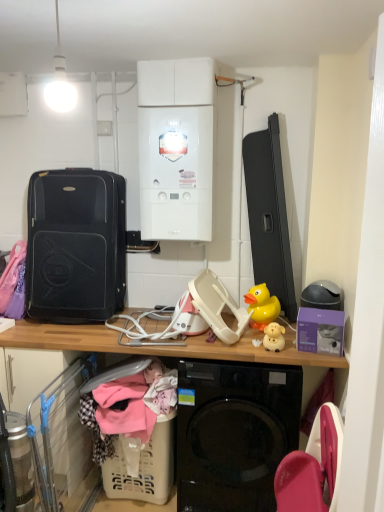
Describe the element at coordinates (160, 345) in the screenshot. I see `wooden desk at center` at that location.

Find the location of a particular element. This screenshot has width=384, height=512. matte yellow plastic toy at center, which is counted as the 1th toy, starting from the front is located at coordinates (274, 337).

In order to click on black hardshell suitcase at left in this screenshot , I will do `click(75, 245)`.

Locate an element on the screen. wooden desk at center is located at coordinates point(160,345).

How many degrees apart are the facing directions of yellow rubber duck at upper right, positioned as the 1th toy in back-to-front order, and beige plastic laundry basket at lower left?

The facing directions of yellow rubber duck at upper right, positioned as the 1th toy in back-to-front order, and beige plastic laundry basket at lower left are 43.2 degrees apart.

Is yellow rubber duck at upper right, which appears as the 2th toy when viewed from the front, aimed at beige plastic laundry basket at lower left?

No, yellow rubber duck at upper right, which appears as the 2th toy when viewed from the front, is not oriented towards beige plastic laundry basket at lower left.

Are yellow rubber duck at upper right, positioned as the 1th toy in back-to-front order, and beige plastic laundry basket at lower left far apart?

Actually, yellow rubber duck at upper right, positioned as the 1th toy in back-to-front order, and beige plastic laundry basket at lower left are a little close together.

Which is less distant, (115,406) or (32,308)?

The point (115,406) is closer to the camera.

Would you consider soft cotton clothes at lower center to be distant from black hardshell suitcase at left?

No.

The height and width of the screenshot is (512, 384). I want to click on clothing in front of the black hardshell suitcase at left, so click(128, 408).

Is beige plastic laundry basket at lower left next to black hardshell suitcase at left?

No, beige plastic laundry basket at lower left is not touching black hardshell suitcase at left.

Looking at this image, could black hardshell suitcase at left be considered to be inside beige plastic laundry basket at lower left?

No, black hardshell suitcase at left is not a part of beige plastic laundry basket at lower left.

The width and height of the screenshot is (384, 512). Find the location of `basket that appears below the black hardshell suitcase at left (from the image's perspective)`. basket that appears below the black hardshell suitcase at left (from the image's perspective) is located at coordinates pyautogui.click(x=144, y=466).

Which of these two, beige plastic laundry basket at lower left or black hardshell suitcase at left, is thinner?

With smaller width is beige plastic laundry basket at lower left.

From a real-world perspective, is yellow rubber duck at upper right, positioned as the 1th toy in back-to-front order, located higher than white glossy boiler at upper center?

Incorrect, from a real-world perspective, yellow rubber duck at upper right, positioned as the 1th toy in back-to-front order, is lower than white glossy boiler at upper center.

Considering the relative sizes of yellow rubber duck at upper right, positioned as the 1th toy in back-to-front order, and white glossy boiler at upper center in the image provided, is yellow rubber duck at upper right, positioned as the 1th toy in back-to-front order, taller than white glossy boiler at upper center?

In fact, yellow rubber duck at upper right, positioned as the 1th toy in back-to-front order, may be shorter than white glossy boiler at upper center.

Considering the sizes of yellow rubber duck at upper right, which appears as the 2th toy when viewed from the front, and white glossy boiler at upper center in the image, is yellow rubber duck at upper right, which appears as the 2th toy when viewed from the front, bigger or smaller than white glossy boiler at upper center?

yellow rubber duck at upper right, which appears as the 2th toy when viewed from the front, is smaller than white glossy boiler at upper center.

Between yellow rubber duck at upper right, which appears as the 2th toy when viewed from the front, and white glossy boiler at upper center, which one has smaller width?

yellow rubber duck at upper right, which appears as the 2th toy when viewed from the front.

Is wooden desk at center inside the boundaries of matte yellow plastic toy at center, the second toy positioned from the back, or outside?

wooden desk at center is located beyond the bounds of matte yellow plastic toy at center, the second toy positioned from the back.

Is wooden desk at center bigger than matte yellow plastic toy at center, which is counted as the 1th toy, starting from the front?

Yes, wooden desk at center is bigger than matte yellow plastic toy at center, which is counted as the 1th toy, starting from the front.

From the image's perspective, is wooden desk at center below matte yellow plastic toy at center, the second toy positioned from the back?

Yes, from the image's perspective, wooden desk at center is beneath matte yellow plastic toy at center, the second toy positioned from the back.

Is wooden desk at center not close to white glossy boiler at upper center?

They are positioned close to each other.

From the image's perspective, which one is positioned higher, wooden desk at center or white glossy boiler at upper center?

white glossy boiler at upper center is shown above in the image.

Is wooden desk at center taller or shorter than white glossy boiler at upper center?

Considering their sizes, wooden desk at center has less height than white glossy boiler at upper center.

Is wooden desk at center outside of white glossy boiler at upper center?

Yes.

Which is more to the right, soft cotton clothes at lower center or wooden desk at center?

wooden desk at center is more to the right.

Where is `desk in front of the soft cotton clothes at lower center`? desk in front of the soft cotton clothes at lower center is located at coordinates (160, 345).

Is soft cotton clothes at lower center oriented towards wooden desk at center?

Yes.

Considering the relative sizes of soft cotton clothes at lower center and wooden desk at center in the image provided, is soft cotton clothes at lower center taller than wooden desk at center?

No, soft cotton clothes at lower center is not taller than wooden desk at center.

Locate an element on the screen. Image resolution: width=384 pixels, height=512 pixels. the 2nd toy above the beige plastic laundry basket at lower left (from a real-world perspective) is located at coordinates (262, 306).

Find the location of a particular element. This screenshot has height=512, width=384. clothing on the right of black hardshell suitcase at left is located at coordinates (128, 408).

Estimate the real-world distances between objects in this image. Which object is further from soft cotton clothes at lower center, beige plastic laundry basket at lower left or wooden desk at center?

wooden desk at center is positioned further to the anchor soft cotton clothes at lower center.

From the image, which object appears to be farther from wooden desk at center, beige plastic laundry basket at lower left or black hardshell suitcase at left?

beige plastic laundry basket at lower left is further to wooden desk at center.

When comparing their distances from wooden desk at center, does white glossy boiler at upper center or matte yellow plastic toy at center, the second toy positioned from the back, seem further?

white glossy boiler at upper center.

Based on their spatial positions, is black hardshell suitcase at left or yellow rubber duck at upper right, which appears as the 2th toy when viewed from the front, further from white glossy boiler at upper center?

The object further to white glossy boiler at upper center is yellow rubber duck at upper right, which appears as the 2th toy when viewed from the front.

Looking at the image, which one is located closer to wooden desk at center, yellow rubber duck at upper right, positioned as the 1th toy in back-to-front order, or white glossy boiler at upper center?

yellow rubber duck at upper right, positioned as the 1th toy in back-to-front order.

Looking at the image, which one is located further to yellow rubber duck at upper right, which appears as the 2th toy when viewed from the front, soft cotton clothes at lower center or matte yellow plastic toy at center, which is counted as the 1th toy, starting from the front?

Based on the image, soft cotton clothes at lower center appears to be further to yellow rubber duck at upper right, which appears as the 2th toy when viewed from the front.

Based on their spatial positions, is white glossy boiler at upper center or wooden desk at center further from black hardshell suitcase at left?

wooden desk at center is positioned further to the anchor black hardshell suitcase at left.

Considering their positions, is soft cotton clothes at lower center positioned further to white glossy boiler at upper center than black hardshell suitcase at left?

Based on the image, soft cotton clothes at lower center appears to be further to white glossy boiler at upper center.

Find the location of a particular element. This screenshot has height=512, width=384. desk located between soft cotton clothes at lower center and yellow rubber duck at upper right, positioned as the 1th toy in back-to-front order, in the left-right direction is located at coordinates (160, 345).

Find the location of a particular element. This screenshot has height=512, width=384. clothing between white glossy boiler at upper center and beige plastic laundry basket at lower left in the up-down direction is located at coordinates (128, 408).

Where is `toy situated between black hardshell suitcase at left and matte yellow plastic toy at center, the second toy positioned from the back, from left to right`? This screenshot has height=512, width=384. toy situated between black hardshell suitcase at left and matte yellow plastic toy at center, the second toy positioned from the back, from left to right is located at coordinates tap(262, 306).

This screenshot has width=384, height=512. In order to click on luggage and bags between white glossy boiler at upper center and wooden desk at center from top to bottom in this screenshot , I will do `click(75, 245)`.